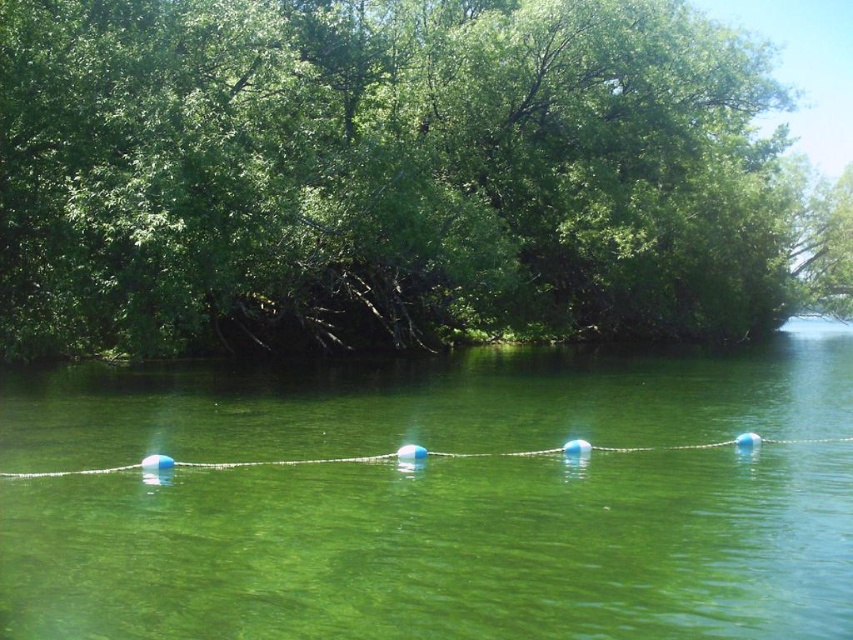
You are a kayaker approaching the green leafy tree at center and the blue rubber buoy at center. Which object will you encounter first?

The green leafy tree at center is closer to you than the blue rubber buoy at center, so you will encounter the green leafy tree at center first.

Based on the coordinates provided, where is the green leafy tree at center located in the image?

The green leafy tree at center is located at the 2D coordinates point (396, 177).

You are standing on a boat in the middle of the water and see the green leafy tree at center and the blue rubber buoy at center. Which object is closer to you?

The blue rubber buoy at center is closer to you because it is positioned below the green leafy tree at center, which is above it.